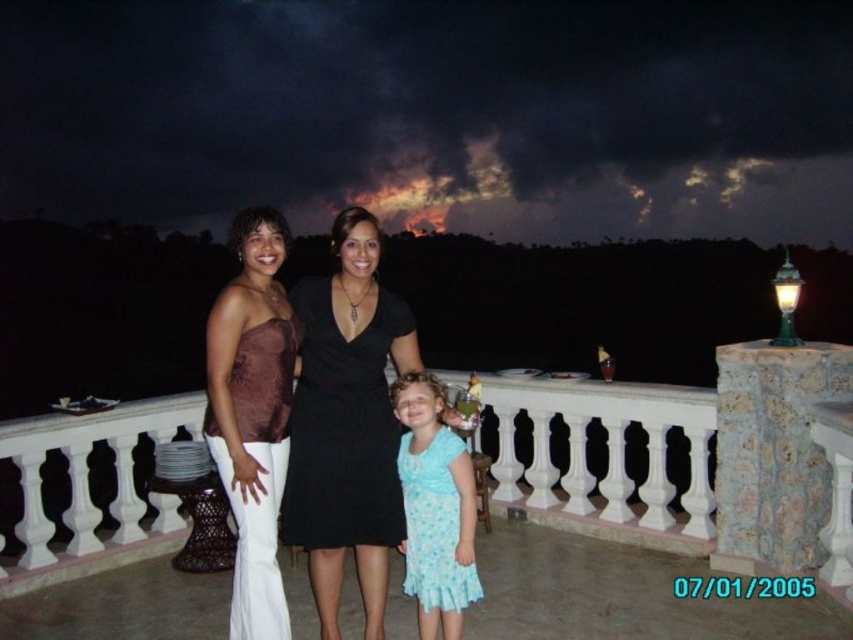
Is matte black dress at center to the right of black matte dress at center from the viewer's perspective?

Incorrect, matte black dress at center is not on the right side of black matte dress at center.

Between point (210, 340) and point (341, 444), which one is positioned behind?

Positioned behind is point (341, 444).

Between point (312, 512) and point (287, 529), which one is positioned behind?

Positioned behind is point (287, 529).

Identify the location of matte black dress at center. (306, 419).

Is point (256, 246) farther from camera compared to point (213, 339)?

Yes, point (256, 246) is behind point (213, 339).

Can you confirm if matte black dress at center is smaller than matte brown fabric dress at left?

Actually, matte black dress at center might be larger than matte brown fabric dress at left.

Does point (262, 337) lie behind point (268, 240)?

No, (262, 337) is in front of (268, 240).

Find the location of a particular element. matte black dress at center is located at coordinates (306, 419).

Can you confirm if black matte dress at center is taller than light blue fabric dress at center?

Indeed, black matte dress at center has a greater height compared to light blue fabric dress at center.

This screenshot has width=853, height=640. What do you see at coordinates (341, 426) in the screenshot? I see `black matte dress at center` at bounding box center [341, 426].

Where is `black matte dress at center`? The width and height of the screenshot is (853, 640). black matte dress at center is located at coordinates (341, 426).